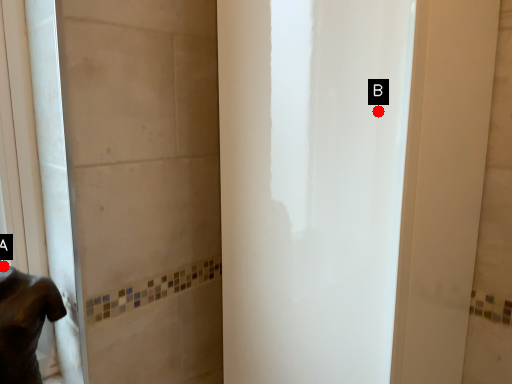
Question: Two points are circled on the image, labeled by A and B beside each circle. Among these points, which one is farthest from the camera?

Choices:
 (A) A is further
 (B) B is further

Answer: (A)